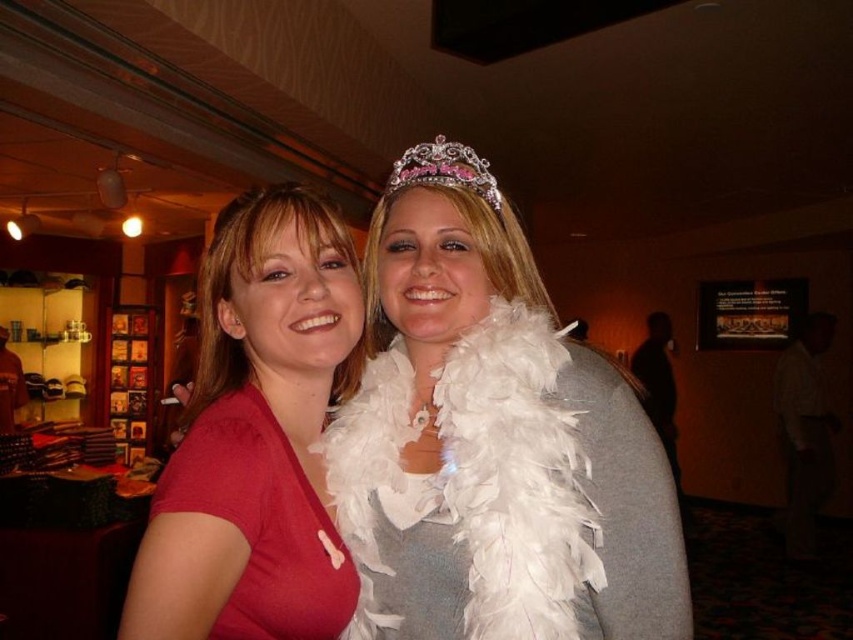
Question: Can you confirm if white feather boa at center is bigger than matte red shirt at center?

Choices:
 (A) yes
 (B) no

Answer: (A)

Question: Is white feather boa at center below matte red dress at left?

Choices:
 (A) yes
 (B) no

Answer: (B)

Question: Which point is closer to the camera?

Choices:
 (A) white feather boa at center
 (B) matte red dress at left

Answer: (B)

Question: Which object is farther from the camera taking this photo?

Choices:
 (A) sparkly pink tiara at upper center
 (B) white feather boa at center
 (C) matte red shirt at center

Answer: (A)

Question: Where is white feather boa at center located in relation to matte red shirt at center in the image?

Choices:
 (A) right
 (B) left

Answer: (A)

Question: Which point is closer to the camera?

Choices:
 (A) matte red dress at left
 (B) matte red shirt at center
 (C) sparkly pink tiara at upper center
 (D) white feather boa at center

Answer: (B)